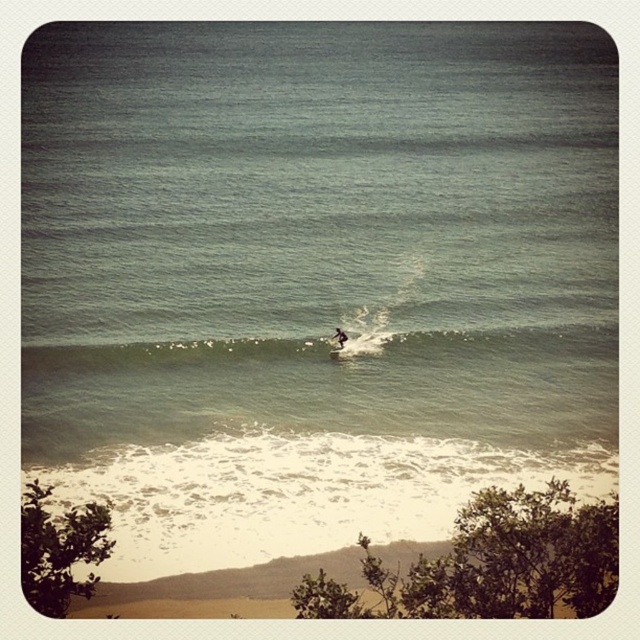
Question: Based on their relative distances, which object is nearer to the white foam wave at center?

Choices:
 (A) white matte surfboard at center
 (B) white foam surfboard at center

Answer: (A)

Question: Which point appears closest to the camera in this image?

Choices:
 (A) (502, 349)
 (B) (332, 356)
 (C) (340, 336)

Answer: (B)

Question: Observing the image, what is the correct spatial positioning of white foam wave at center in reference to white foam surfboard at center?

Choices:
 (A) left
 (B) right

Answer: (A)

Question: From the image, what is the correct spatial relationship of white matte surfboard at center in relation to white foam surfboard at center?

Choices:
 (A) above
 (B) below

Answer: (A)

Question: Does white foam wave at center have a lesser width compared to white foam surfboard at center?

Choices:
 (A) yes
 (B) no

Answer: (B)

Question: Considering the real-world distances, which object is farthest from the white foam surfboard at center?

Choices:
 (A) white matte surfboard at center
 (B) white foam wave at center

Answer: (B)